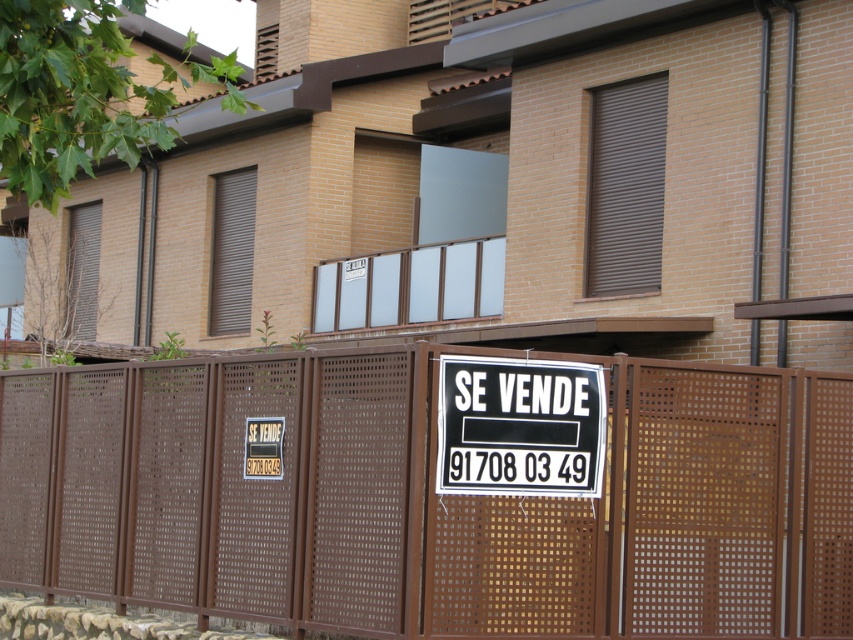
You are a real estate agent who needs to place a new sign on the fence. The new sign is the same size as the existing black paper sign at center. Will the new sign fit on the brown perforated fence at center without overlapping the existing sign?

The brown perforated fence at center is bigger than the black paper sign at center. Since the new sign is the same size as the existing one, there should be enough space on the brown perforated fence at center to place the new sign without overlapping, as the fence is larger than the existing sign.

You are a delivery person trying to deliver a package to the address at the building shown. The package requires a signature, and the recipient is currently inside the building. You need to locate the nearest object to the signboard to leave a note indicating the package has been delivered. Which object should you choose between the brown perforated fence at center and the black paper sign at center?

The brown perforated fence at center is 18.25 inches away from the black paper sign at center, so the closest object to the signboard is the brown perforated fence at center. Therefore, you should leave the note on the brown perforated fence at center.